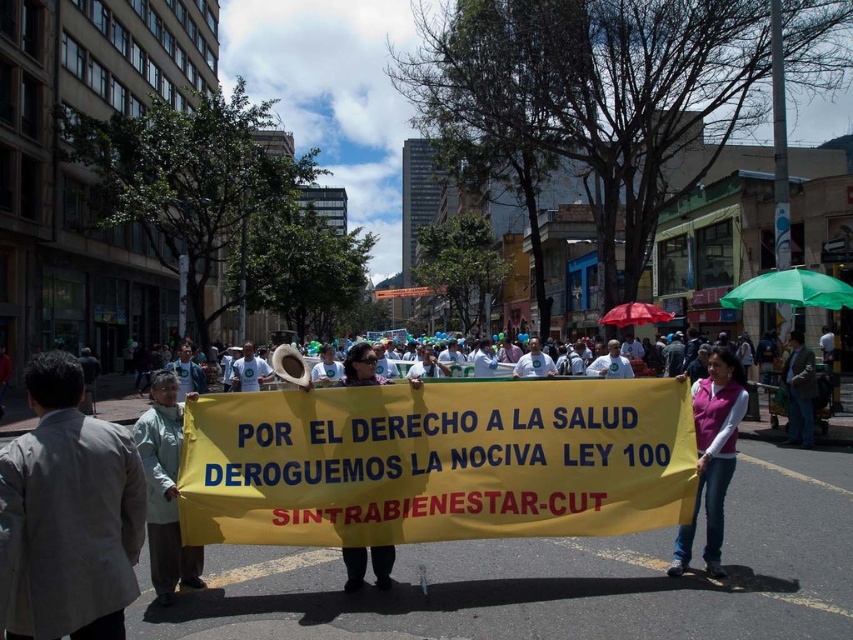
You are a photographer trying to capture the entire matte yellow banner at center in your shot. There is a green fabric umbrella at right that might block your view. Based on their sizes, can you determine if the umbrella will block the banner?

The green fabric umbrella at right has a lesser height compared to the matte yellow banner at center, so the umbrella is shorter and less likely to block the entire banner.

From the picture: You are a photographer standing at the center of the protest scene. You want to capture a photo that includes both the yellow banner and a specific point in the crowd. The yellow banner is located at point (805, 291), and the crowd point is at (364, 349). Since you can only focus on one point clearly, which point should you focus on to ensure the yellow banner remains in the foreground of your photo?

You should focus on point (805, 291) because it is closer to you than point (364, 349). This ensures the yellow banner stays in the foreground while the crowd point will naturally appear in the background.

You are a photographer trying to capture a closeup shot of the pink fleece vest at center and the pink fabric shirt at center. Which one would you focus on to ensure it fits entirely within your camera frame?

The pink fleece vest at center occupies less space than the pink fabric shirt at center, so focusing on the pink fleece vest at center ensures it fits entirely within the camera frame.